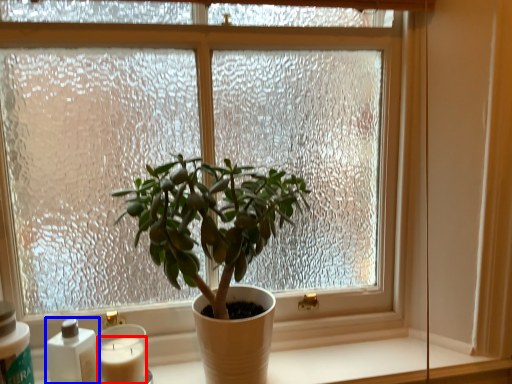
Question: Among these objects, which one is farthest to the camera, candle (highlighted by a red box) or bottle (highlighted by a blue box)?

Choices:
 (A) candle
 (B) bottle

Answer: (A)